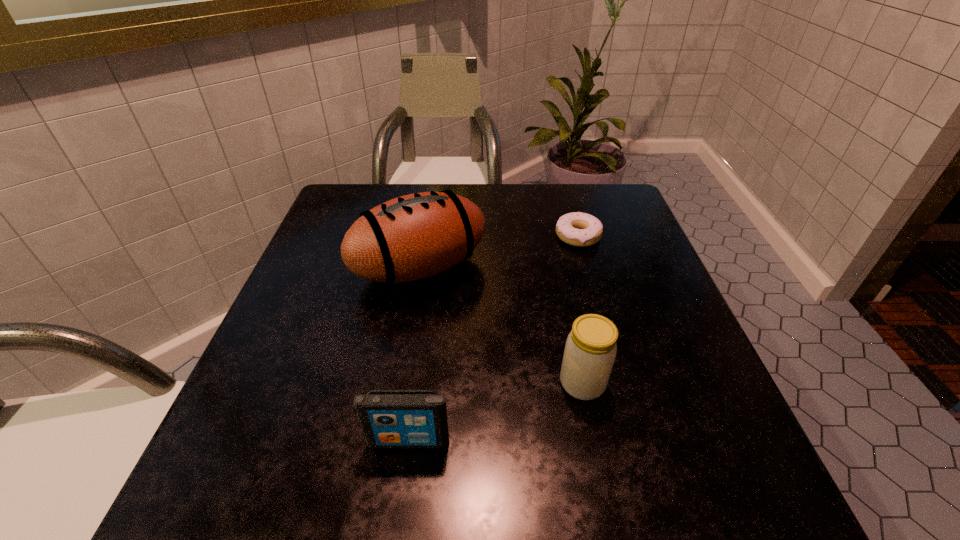
Image resolution: width=960 pixels, height=540 pixels. Find the location of `object positioned at the left edge`. object positioned at the left edge is located at coordinates (416, 236).

Locate an element on the screen. This screenshot has height=540, width=960. object present at the right edge is located at coordinates (579, 229).

Identify the location of object that is at the far right corner. The width and height of the screenshot is (960, 540). (579, 229).

In the image, there is a desktop. Identify the location of vacant space at the far edge. pyautogui.click(x=560, y=186).

The image size is (960, 540). What are the coordinates of `free space at the near edge of the desktop` in the screenshot? It's located at coord(389,495).

Locate an element on the screen. The image size is (960, 540). vacant space at the left edge of the desktop is located at coordinates (307, 268).

In the image, there is a desktop. In order to click on vacant space at the right edge in this screenshot , I will do `click(660, 415)`.

Identify the location of vacant region at the far left corner. (359, 200).

In the image, there is a desktop. At what (x,y) coordinates should I click in order to perform the action: click on vacant space at the near left corner. Please return your answer as a coordinate pair (x, y). The height and width of the screenshot is (540, 960). Looking at the image, I should click on (194, 510).

Where is `vacant space at the near right corner of the desktop`? The image size is (960, 540). vacant space at the near right corner of the desktop is located at coordinates (684, 495).